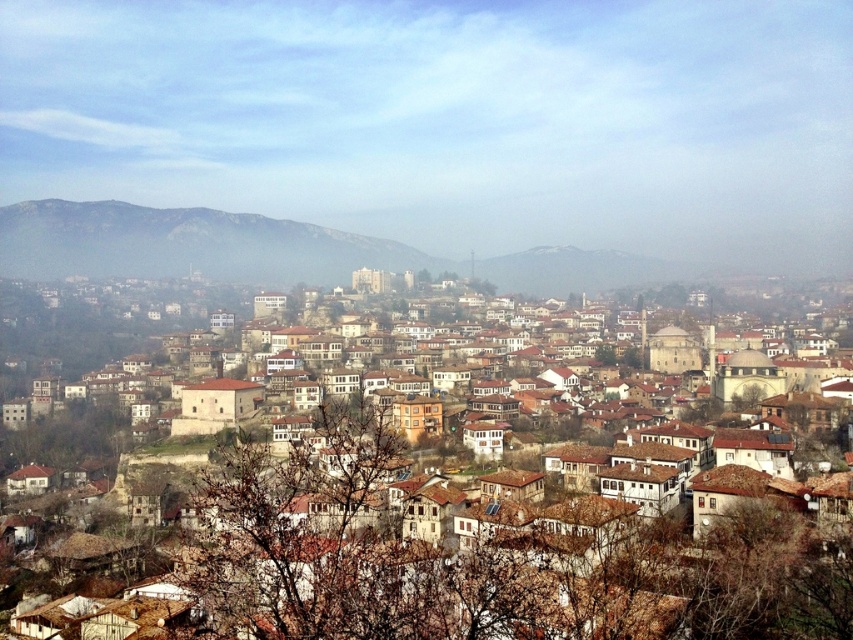
Question: Which object is farther from the camera taking this photo?

Choices:
 (A) rocky brown hillside at left
 (B) brown stone buildings at center

Answer: (A)

Question: Which of the following is the farthest from the observer?

Choices:
 (A) (201, 241)
 (B) (604, 580)

Answer: (A)

Question: Is brown stone buildings at center above rocky brown hillside at left?

Choices:
 (A) no
 (B) yes

Answer: (A)

Question: Where is brown stone buildings at center located in relation to rocky brown hillside at left in the image?

Choices:
 (A) right
 (B) left

Answer: (A)

Question: Does brown stone buildings at center have a greater width compared to rocky brown hillside at left?

Choices:
 (A) yes
 (B) no

Answer: (B)